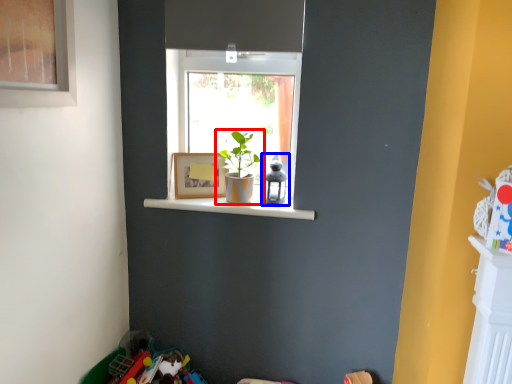
Question: Which of the following is the farthest to the observer, houseplant (highlighted by a red box) or toy (highlighted by a blue box)?

Choices:
 (A) houseplant
 (B) toy

Answer: (B)